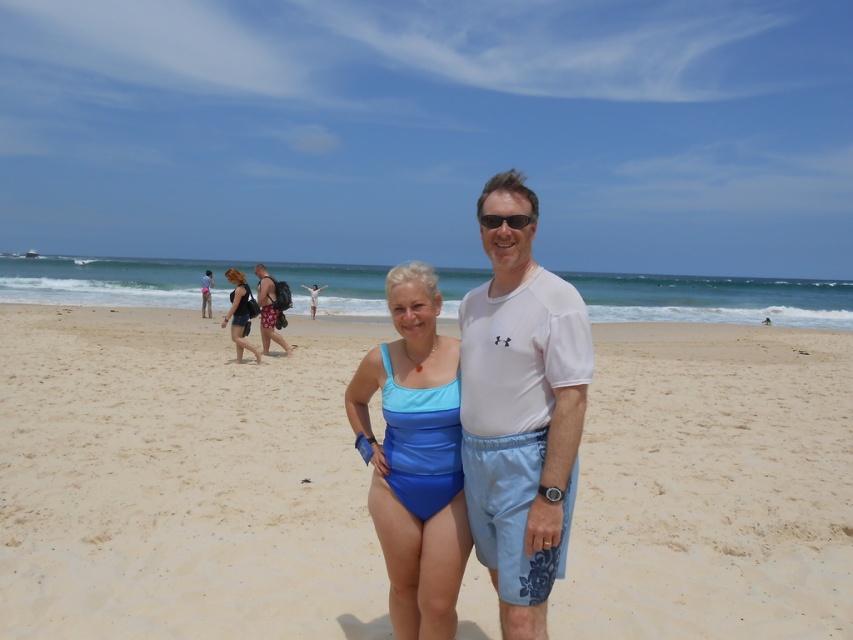
You are standing at the beach and want to take a photo of both the point at coordinates point (404, 548) and point (222, 320). Which point should you focus on first to ensure both are in clear view?

You should focus on point (404, 548) first because it is closer to the camera than point (222, 320). This ensures both points are in focus as the depth of field will cover the farther point.

You are a photographer trying to capture a group photo of two people wearing swimsuits. You need to ensure they are positioned exactly 1.5 meters apart for the shot. Based on the scene described, are the matte black swimsuit at center and blue fabric swimsuit at center positioned correctly for your photo?

The matte black swimsuit at center and blue fabric swimsuit at center are 1.52 meters apart from each other, which is slightly more than the required 1.5 meters. They are positioned correctly for the photo.